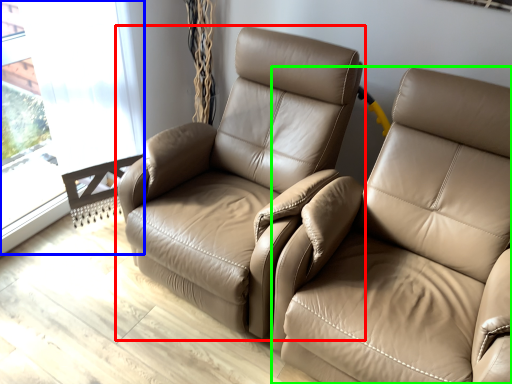
Question: Which object is the closest to the chair (highlighted by a red box)? Choose among these: window (highlighted by a blue box) or studio couch (highlighted by a green box).

Choices:
 (A) window
 (B) studio couch

Answer: (B)